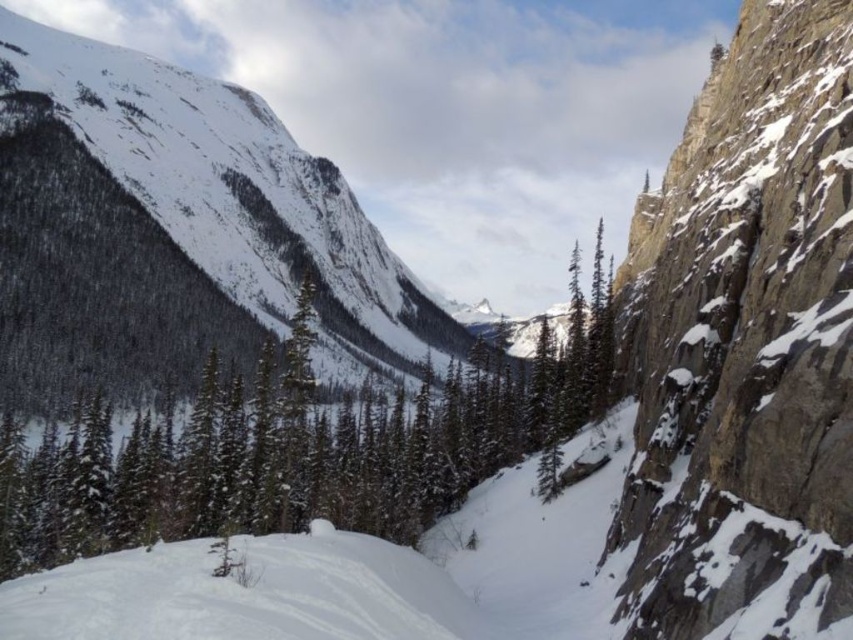
Question: Can you confirm if rocky cliff at right is positioned above white snow ski slope at lower left?

Choices:
 (A) yes
 (B) no

Answer: (A)

Question: Is snowy rock mountain at upper left positioned in front of white snow ski slope at lower left?

Choices:
 (A) yes
 (B) no

Answer: (B)

Question: Which object appears closest to the camera in this image?

Choices:
 (A) green textured pine tree at center
 (B) rocky cliff at right
 (C) snowy rock mountain at upper left

Answer: (B)

Question: Which of the following is the farthest from the observer?

Choices:
 (A) (138, 616)
 (B) (306, 412)

Answer: (B)

Question: Which point is farther to the camera?

Choices:
 (A) white snow ski slope at lower left
 (B) rocky cliff at right
 (C) snowy rock mountain at upper left

Answer: (C)

Question: Can you confirm if rocky cliff at right is positioned below snowy rock mountain at upper left?

Choices:
 (A) yes
 (B) no

Answer: (A)